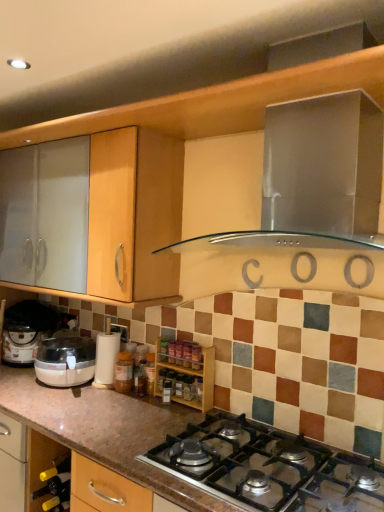
Question: Should I look upward or downward to see stainless steel range hood at upper center?

Choices:
 (A) down
 (B) up

Answer: (B)

Question: From a real-world perspective, is green glass wine bottle at lower left on white plastic coffee machine at lower left?

Choices:
 (A) no
 (B) yes

Answer: (A)

Question: Are green glass wine bottle at lower left and white plastic coffee machine at lower left located far from each other?

Choices:
 (A) yes
 (B) no

Answer: (B)

Question: Can you confirm if green glass wine bottle at lower left is wider than white plastic coffee machine at lower left?

Choices:
 (A) yes
 (B) no

Answer: (B)

Question: Does green glass wine bottle at lower left appear on the right side of white plastic coffee machine at lower left?

Choices:
 (A) yes
 (B) no

Answer: (B)

Question: Considering the relative positions of green glass wine bottle at lower left and white plastic coffee machine at lower left in the image provided, is green glass wine bottle at lower left to the left of white plastic coffee machine at lower left from the viewer's perspective?

Choices:
 (A) yes
 (B) no

Answer: (A)

Question: Does green glass wine bottle at lower left have a greater height compared to white plastic coffee machine at lower left?

Choices:
 (A) yes
 (B) no

Answer: (B)

Question: Is stainless steel range hood at upper center oriented towards white plastic coffee machine at lower left?

Choices:
 (A) no
 (B) yes

Answer: (A)

Question: Is stainless steel range hood at upper center surrounding white plastic coffee machine at lower left?

Choices:
 (A) no
 (B) yes

Answer: (A)

Question: Is stainless steel range hood at upper center at the right side of white plastic coffee machine at lower left?

Choices:
 (A) yes
 (B) no

Answer: (A)

Question: Is stainless steel range hood at upper center closer to the viewer compared to white plastic coffee machine at lower left?

Choices:
 (A) no
 (B) yes

Answer: (B)

Question: Is stainless steel range hood at upper center not within white plastic coffee machine at lower left?

Choices:
 (A) yes
 (B) no

Answer: (A)

Question: Is the position of stainless steel range hood at upper center more distant than that of white plastic coffee machine at lower left?

Choices:
 (A) yes
 (B) no

Answer: (B)

Question: From a real-world perspective, is stainless steel range hood at upper center positioned under metallic silver gas stove at center based on gravity?

Choices:
 (A) no
 (B) yes

Answer: (A)